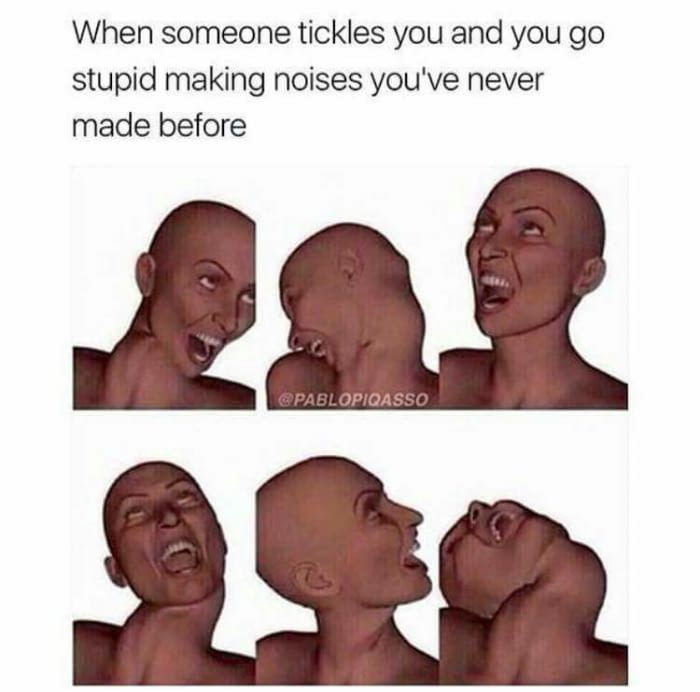
Locate an element on the screen. This screenshot has height=692, width=700. wall is located at coordinates (536, 446).